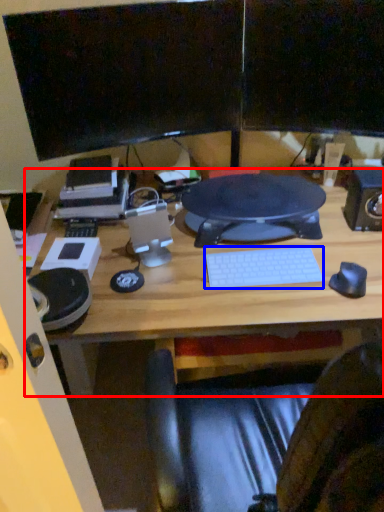
Question: Which object is further to the camera taking this photo, desk (highlighted by a red box) or computer keyboard (highlighted by a blue box)?

Choices:
 (A) desk
 (B) computer keyboard

Answer: (B)